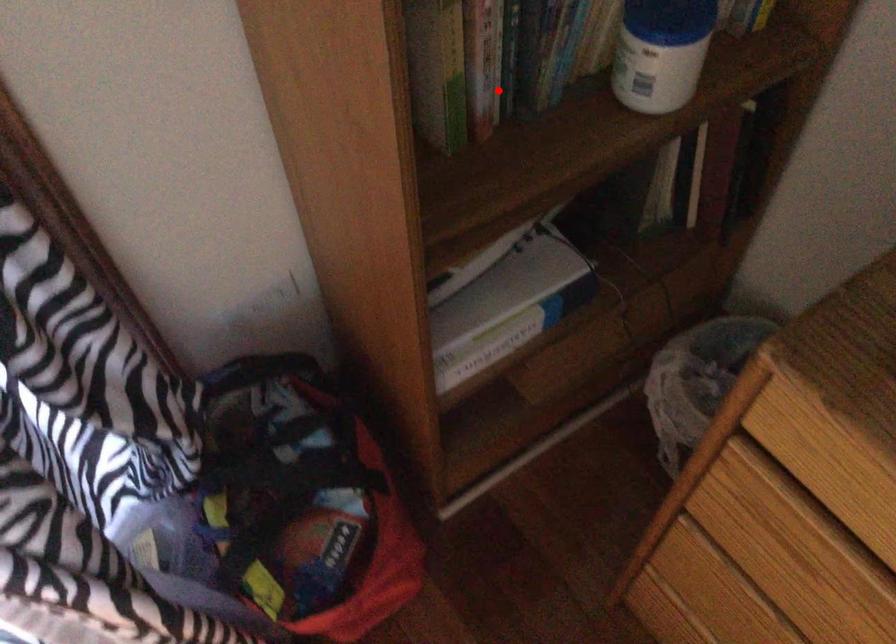
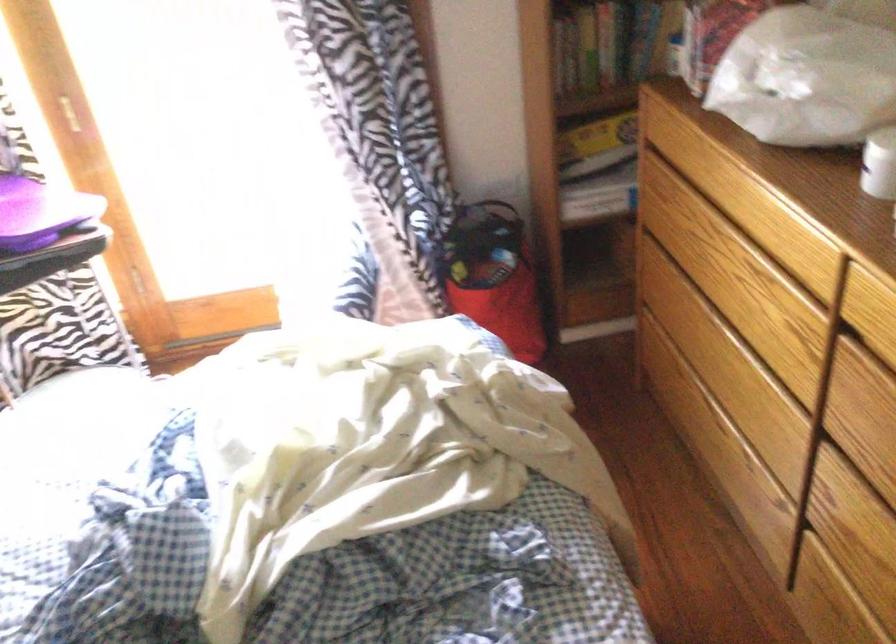
Find the pixel in the second image that matches the highlighted location in the first image.

(606, 44)